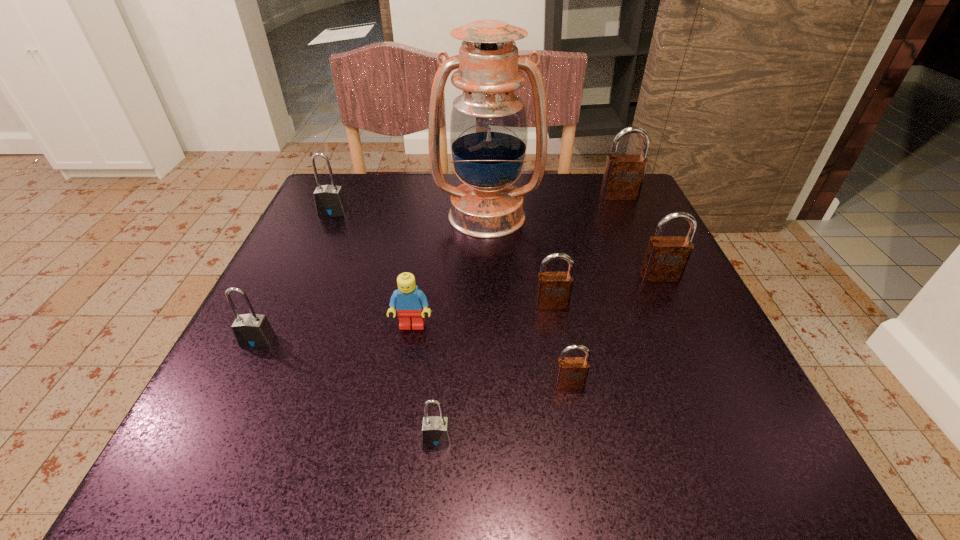
Locate an element on the screen. blank region between the eighth farthest object and the blue Lego is located at coordinates (491, 355).

Find the location of `empty space that is in between the third farthest padlock and the oil lamp`. empty space that is in between the third farthest padlock and the oil lamp is located at coordinates (573, 246).

Locate which object is the closest to the second farthest brown padlock. Please provide its 2D coordinates. Your answer should be formatted as a tuple, i.e. [(x, y)], where the tuple contains the x and y coordinates of a point satisfying the conditions above.

[(554, 289)]

You are a GUI agent. You are given a task and a screenshot of the screen. Output one action in this format:
    pyautogui.click(x=<x>, y=<y>)
    Task: Click on the object that is the second closest to the tallest padlock
    This screenshot has width=960, height=540.
    Given the screenshot: What is the action you would take?
    pyautogui.click(x=666, y=257)

Identify which padlock is the fifth nearest to the smallest gray padlock. Please provide its 2D coordinates. Your answer should be formatted as a tuple, i.e. [(x, y)], where the tuple contains the x and y coordinates of a point satisfying the conditions above.

[(329, 200)]

You are a GUI agent. You are given a task and a screenshot of the screen. Output one action in this format:
    pyautogui.click(x=<x>, y=<y>)
    Task: Click on the fourth closest padlock to the biggest brown padlock
    The height and width of the screenshot is (540, 960).
    Given the screenshot: What is the action you would take?
    pyautogui.click(x=329, y=200)

Locate an element on the screen. Image resolution: width=960 pixels, height=540 pixels. brown padlock that is the closest to the second smallest gray padlock is located at coordinates (554, 289).

The width and height of the screenshot is (960, 540). I want to click on the third closest brown padlock to the second farthest padlock, so click(x=571, y=373).

Choose which gray padlock is the second nearest neighbor to the biggest gray padlock. Please provide its 2D coordinates. Your answer should be formatted as a tuple, i.e. [(x, y)], where the tuple contains the x and y coordinates of a point satisfying the conditions above.

[(436, 431)]

Identify which gray padlock is the second nearest to the blue oil lamp. Please provide its 2D coordinates. Your answer should be formatted as a tuple, i.e. [(x, y)], where the tuple contains the x and y coordinates of a point satisfying the conditions above.

[(252, 330)]